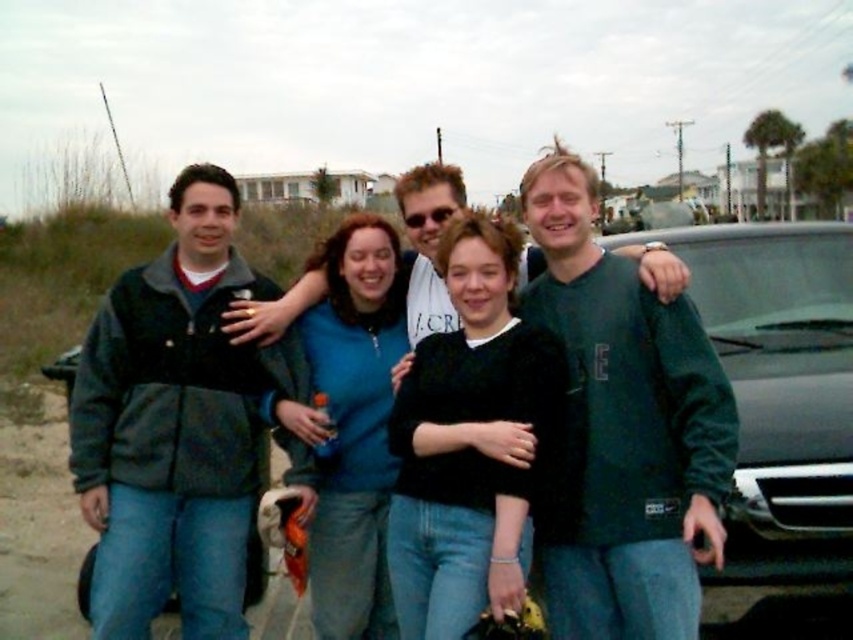
You are trying to decide which clothing item to take for a photo shoot based on their size. You have the dark gray fleece jacket at left and the black fuzzy sweater at center. Which one should you choose if you want the larger item?

The black fuzzy sweater at center is larger than the dark gray fleece jacket at left, so you should choose the black fuzzy sweater at center for the photo shoot if you want the larger item.

From the picture: You are a photographer trying to adjust the focus of your camera to capture both the dark gray fleece jacket at left and the black fuzzy sweater at center. Which one is positioned higher in the frame?

The dark gray fleece jacket at left is above the black fuzzy sweater at center, so it is positioned higher in the frame.

You are trying to locate the black fuzzy sweater at center in a group photo. Which direction should you look from the dark gray fleece jacket at left to find it?

The dark gray fleece jacket at left is positioned on the left side of black fuzzy sweater at center, so you should look to the right from the dark gray fleece jacket at left to find the black fuzzy sweater at center.